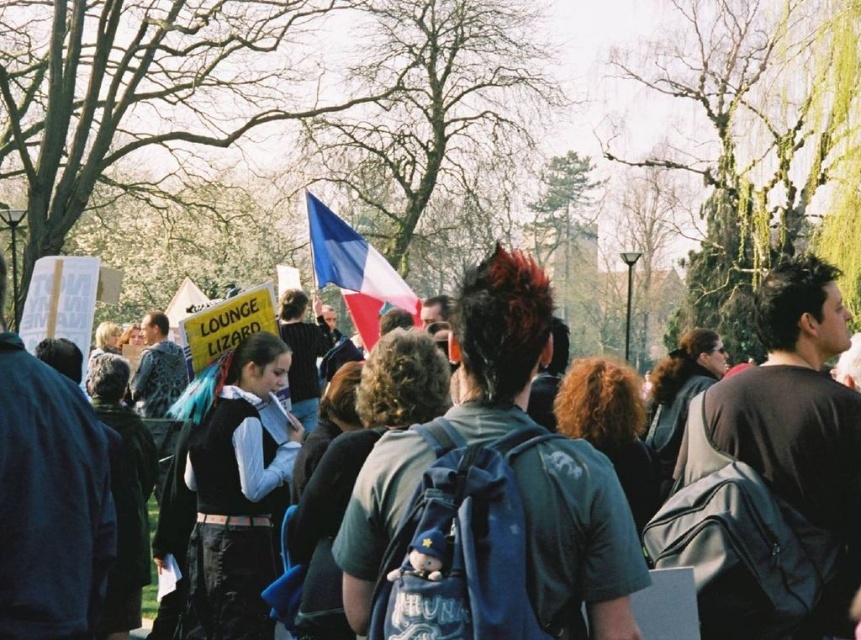
You are organizing a protest and need to decide where to place a new banner. The banner is larger than the dark gray backpack at center. Based on the scene, can the banner fit in the space where the blue fabric flag at center is currently located?

The dark gray backpack at center is larger than the blue fabric flag at center. Since the banner is larger than the dark gray backpack at center, it would be too big to fit in the space where the blue fabric flag at center is located.

You are standing at the point with coordinates point (x=317, y=221) and want to walk to the point with coordinates point (x=709, y=410). Which direction should you move in relation to the two points?

You should move towards point (x=709, y=410), which is in front of point (x=317, y=221).

You are a photographer at the protest, and you want to capture both the dark gray backpack at center and the blue fabric flag at center in a single frame. Based on their positions, which object should you focus on first to ensure both are in the shot?

The dark gray backpack at center is located below the blue fabric flag at center. To capture both in a single frame, focus on the blue fabric flag at center first since it is higher up, allowing the backpack to naturally fall into the lower part of the frame.